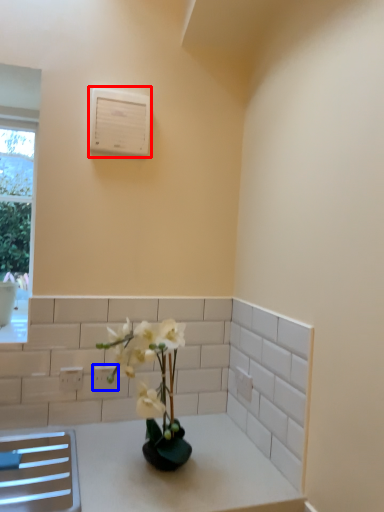
Question: Among these objects, which one is farthest to the camera, air conditioning (highlighted by a red box) or electric outlet (highlighted by a blue box)?

Choices:
 (A) air conditioning
 (B) electric outlet

Answer: (B)